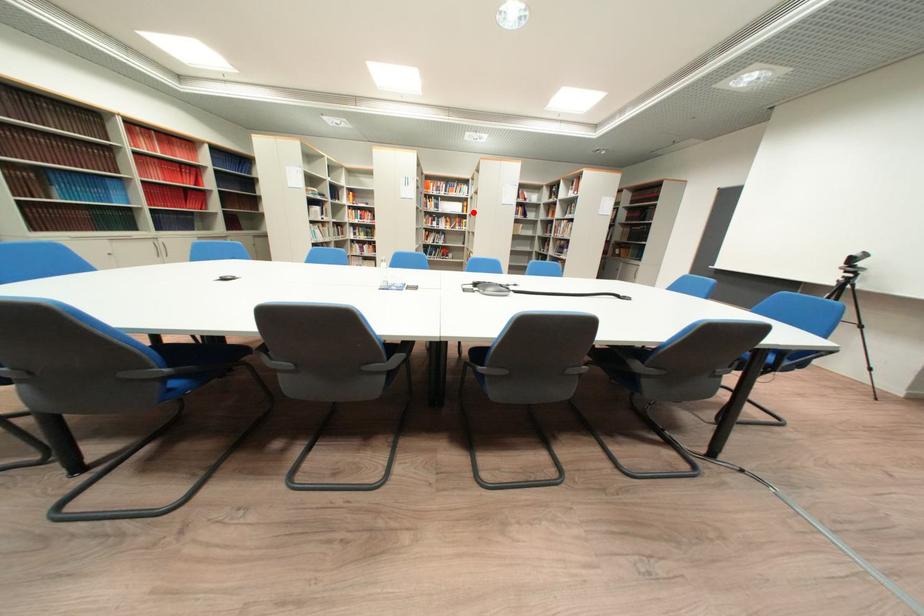
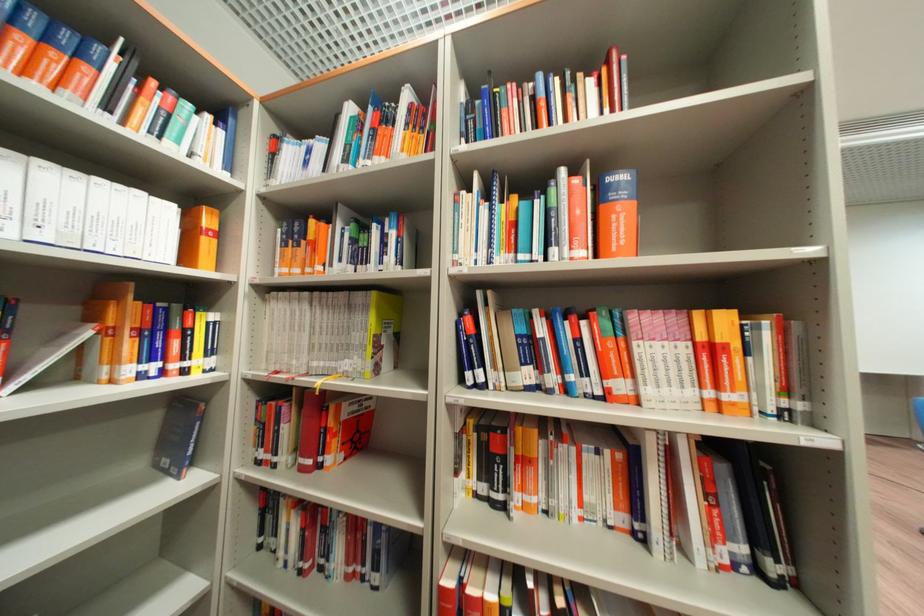
Question: I am providing you with two images of the same scene from different viewpoints. Image1 has a red point marked. In image2, the corresponding 3D location appears at what relative position? Reply with the corresponding letter.

Choices:
 (A) Closer
 (B) Farther

Answer: (B)